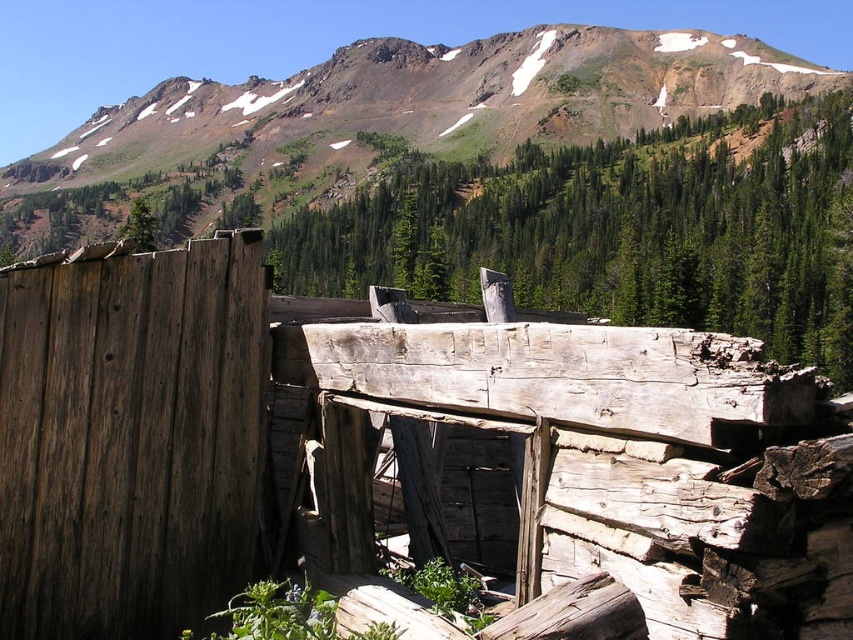
Does weathered wood fence at left have a larger size compared to rugged brown mountain at upper center?

Incorrect, weathered wood fence at left is not larger than rugged brown mountain at upper center.

Can you confirm if weathered wood fence at left is taller than rugged brown mountain at upper center?

Incorrect, weathered wood fence at left's height is not larger of rugged brown mountain at upper center's.

Does point (119, 372) lie behind point (90, 232)?

No, it is not.

Identify the location of weathered wood fence at left. This screenshot has width=853, height=640. (396, 454).

Between dark brown weathered wood at left and rugged brown mountain at upper center, which one has less height?

dark brown weathered wood at left is shorter.

How distant is dark brown weathered wood at left from rugged brown mountain at upper center?

They are 210.00 meters apart.

Find the location of a particular element. dark brown weathered wood at left is located at coordinates coord(131,436).

Can you confirm if weathered wood fence at left is positioned to the left of dark brown weathered wood at left?

No, weathered wood fence at left is not to the left of dark brown weathered wood at left.

The image size is (853, 640). I want to click on weathered wood fence at left, so click(x=396, y=454).

Who is more forward, (277, 563) or (9, 451)?

Positioned in front is point (9, 451).

I want to click on weathered wood fence at left, so click(396, 454).